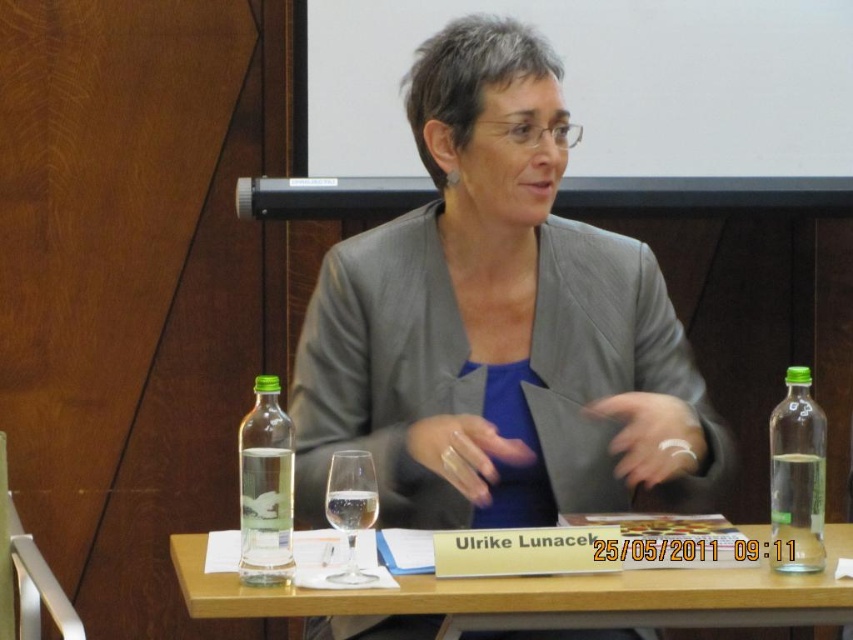
Can you confirm if gray fabric jacket at center is taller than clear glass bottle at right?

Indeed, gray fabric jacket at center has a greater height compared to clear glass bottle at right.

Locate an element on the screen. The height and width of the screenshot is (640, 853). gray fabric jacket at center is located at coordinates (496, 323).

Where is `gray fabric jacket at center`? This screenshot has width=853, height=640. gray fabric jacket at center is located at coordinates (496, 323).

Which is more to the right, clear glass bottle at right or clear glass wine glass at center?

clear glass bottle at right

Which is behind, point (817, 508) or point (351, 480)?

Positioned behind is point (817, 508).

Locate an element on the screen. The image size is (853, 640). clear glass bottle at right is located at coordinates (796, 477).

Is point (579, 442) closer to camera compared to point (347, 538)?

That is False.

Does gray fabric jacket at center have a greater width compared to clear glass wine glass at center?

Correct, the width of gray fabric jacket at center exceeds that of clear glass wine glass at center.

Between point (583, 291) and point (364, 461), which one is positioned behind?

Positioned behind is point (583, 291).

Where is `gray fabric jacket at center`? gray fabric jacket at center is located at coordinates (496, 323).